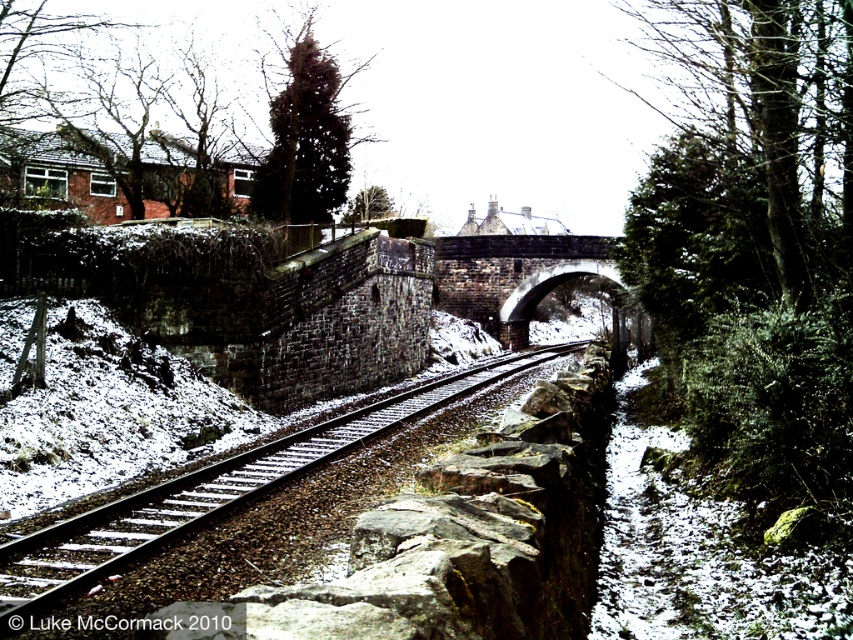
Question: Which point is farther to the camera?

Choices:
 (A) dark gray stone bridge at center
 (B) metal/smooth track at center

Answer: (A)

Question: Which point is farther to the camera?

Choices:
 (A) (213, 486)
 (B) (572, 257)

Answer: (B)

Question: Does metal/smooth track at center lie behind dark gray stone bridge at center?

Choices:
 (A) no
 (B) yes

Answer: (A)

Question: Is metal/smooth track at center below dark gray stone bridge at center?

Choices:
 (A) no
 (B) yes

Answer: (B)

Question: Can you confirm if metal/smooth track at center is wider than dark gray stone bridge at center?

Choices:
 (A) no
 (B) yes

Answer: (A)

Question: Which point is farther from the camera taking this photo?

Choices:
 (A) (440, 291)
 (B) (345, 442)

Answer: (A)